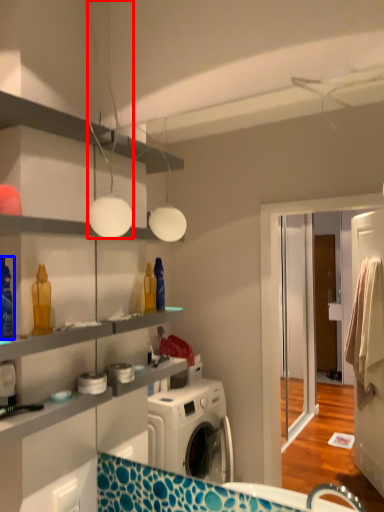
Question: Which point is further to the camera, light fixture (highlighted by a red box) or cleaning product (highlighted by a blue box)?

Choices:
 (A) light fixture
 (B) cleaning product

Answer: (A)